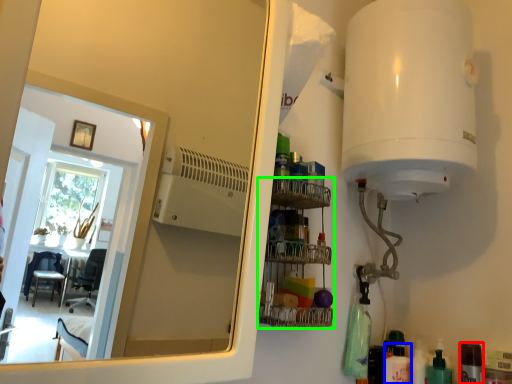
Question: Which object is positioned farthest from toiletry (highlighted by a red box)? Select from toiletry (highlighted by a blue box) and shelf (highlighted by a green box).

Choices:
 (A) toiletry
 (B) shelf

Answer: (B)